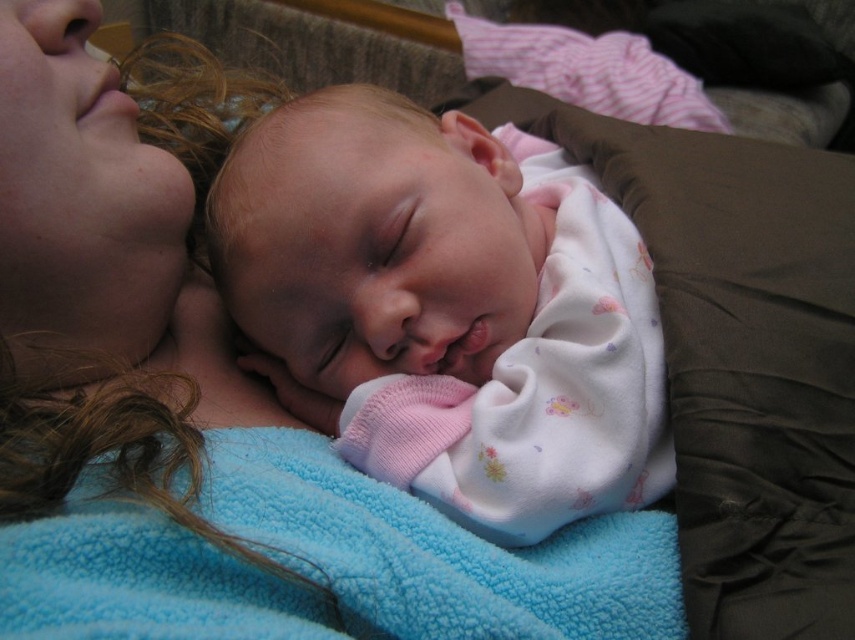
In the scene, there is a pink cotton baby at center and a soft blue fleece blanket at upper left. From the perspective of someone looking at the image, which object is positioned to the left of the other?

The soft blue fleece blanket at upper left is to the left of the pink cotton baby at center.

You are a photographer trying to capture the mother and baby in this scene. You want to ensure the pink cotton baby at center stays visible in the photo. Should you adjust the position of the soft blue fleece blanket at upper left to avoid covering the baby?

The pink cotton baby at center is positioned under the soft blue fleece blanket at upper left, so adjusting the blanket would help keep the baby visible by preventing it from being covered.